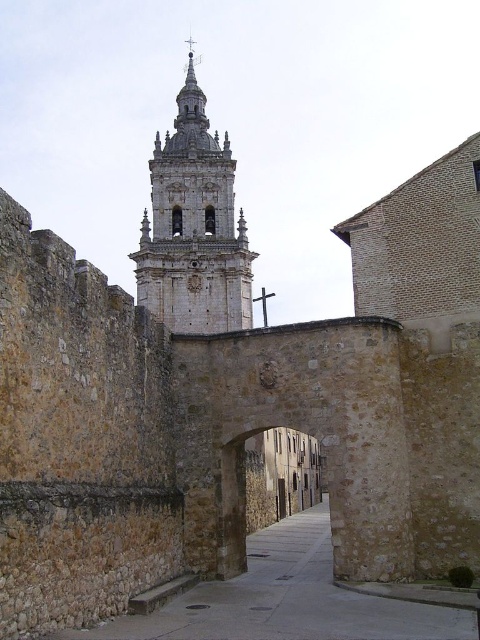
Question: Where is smooth stone alley at center located in relation to white stone tower at center in the image?

Choices:
 (A) below
 (B) above

Answer: (A)

Question: Which point is farther to the camera?

Choices:
 (A) smooth stone alley at center
 (B) white stone tower at center

Answer: (B)

Question: Which of the following is the closest to the observer?

Choices:
 (A) (229, 273)
 (B) (243, 604)

Answer: (B)

Question: In this image, where is smooth stone alley at center located relative to white stone tower at center?

Choices:
 (A) below
 (B) above

Answer: (A)

Question: Considering the relative positions of smooth stone alley at center and white stone tower at center in the image provided, where is smooth stone alley at center located with respect to white stone tower at center?

Choices:
 (A) below
 (B) above

Answer: (A)

Question: Among these objects, which one is farthest from the camera?

Choices:
 (A) smooth stone alley at center
 (B) white stone tower at center

Answer: (B)